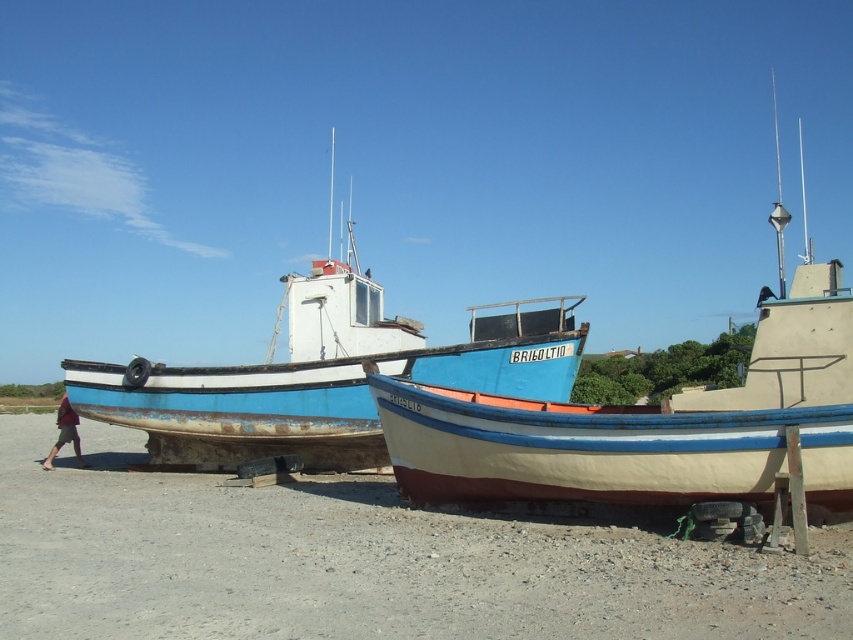
Question: Considering the real-world distances, which object is closest to the red cotton shirt at lower left?

Choices:
 (A) rusty metal boat at lower center
 (B) blue wooden boat at center

Answer: (A)

Question: From the image, what is the correct spatial relationship of blue painted wood boat at center in relation to blue wooden boat at center?

Choices:
 (A) below
 (B) above

Answer: (B)

Question: Considering the real-world distances, which object is farthest from the rusty metal boat at lower center?

Choices:
 (A) blue painted wood boat at center
 (B) blue wooden boat at center
 (C) red cotton shirt at lower left

Answer: (A)

Question: Where is blue painted wood boat at center located in relation to red cotton shirt at lower left in the image?

Choices:
 (A) below
 (B) above

Answer: (B)

Question: Does rusty metal boat at lower center lie in front of blue painted wood boat at center?

Choices:
 (A) no
 (B) yes

Answer: (B)

Question: Which object is the closest to the blue wooden boat at center?

Choices:
 (A) rusty metal boat at lower center
 (B) red cotton shirt at lower left

Answer: (A)